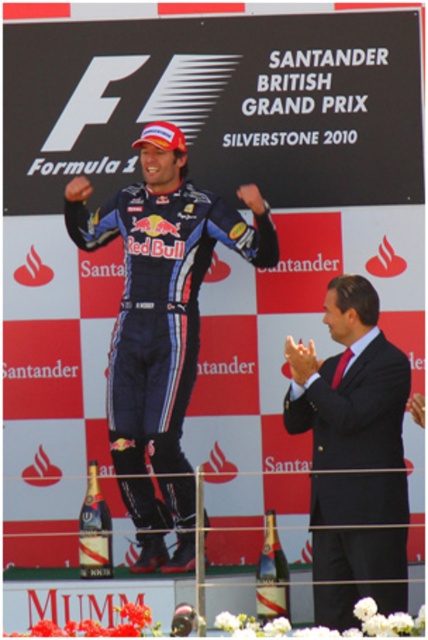
Question: Which of the following is the closest to the observer?

Choices:
 (A) (321, 449)
 (B) (112, 570)

Answer: (A)

Question: Can you confirm if gold foil champagne bottle at center is thinner than translucent glass bottle at center?

Choices:
 (A) yes
 (B) no

Answer: (A)

Question: Which object is positioned farthest from the black suit at center?

Choices:
 (A) gold foil champagne bottle at center
 (B) translucent glass bottle at center

Answer: (A)

Question: Does shiny blue suit at center have a larger size compared to translucent glass bottle at center?

Choices:
 (A) yes
 (B) no

Answer: (A)

Question: Which object is the farthest from the translucent glass bottle at center?

Choices:
 (A) black suit at center
 (B) shiny blue suit at center
 (C) gold foil champagne bottle at center

Answer: (C)

Question: Is black suit at center wider than translucent glass bottle at center?

Choices:
 (A) yes
 (B) no

Answer: (A)